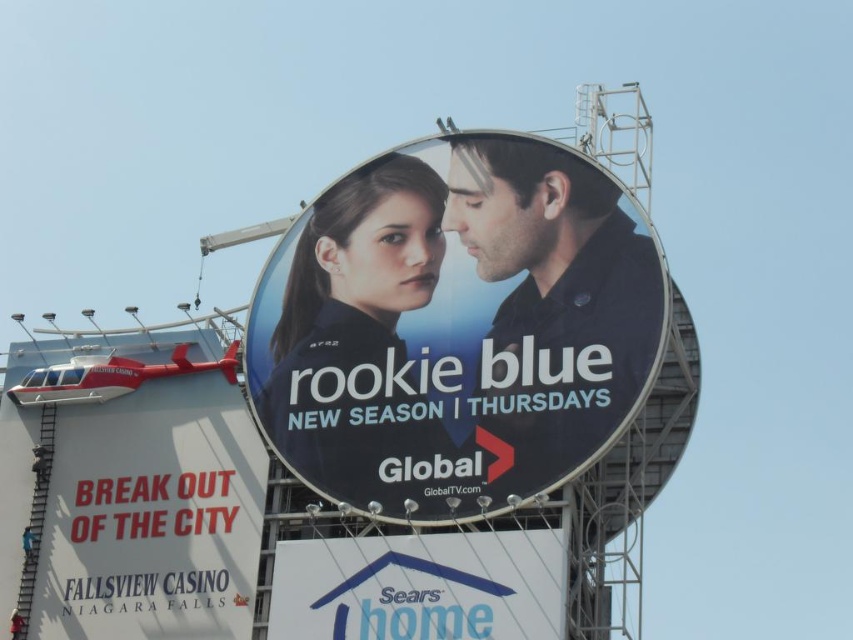
Can you confirm if metallic red helicopter at upper left is positioned below matte black shirt at center?

Yes, metallic red helicopter at upper left is below matte black shirt at center.

Between metallic red helicopter at upper left and matte black shirt at center, which one appears on the left side from the viewer's perspective?

Positioned to the left is metallic red helicopter at upper left.

Is point (136, 490) farther from camera compared to point (589, 316)?

Yes, it is behind point (589, 316).

This screenshot has height=640, width=853. In order to click on metallic red helicopter at upper left in this screenshot , I will do `click(151, 516)`.

Between matte black shirt at center and white plastic sign at lower center, which one is positioned lower?

Positioned lower is white plastic sign at lower center.

Between matte black shirt at center and white plastic sign at lower center, which one appears on the right side from the viewer's perspective?

From the viewer's perspective, matte black shirt at center appears more on the right side.

Measure the distance between point (x=476, y=241) and camera.

They are 64.12 meters apart.

At what (x,y) coordinates should I click in order to perform the action: click on matte black shirt at center. Please return your answer as a coordinate pair (x, y). The image size is (853, 640). Looking at the image, I should click on (556, 291).

Does matte black billboard at center have a greater width compared to metallic red helicopter at upper left?

Yes.

Can you confirm if matte black billboard at center is positioned to the right of metallic red helicopter at upper left?

Yes, matte black billboard at center is to the right of metallic red helicopter at upper left.

Who is more distant from viewer, (521, 372) or (234, 477)?

The point (234, 477) is behind.

The width and height of the screenshot is (853, 640). Find the location of `matte black billboard at center`. matte black billboard at center is located at coordinates (457, 324).